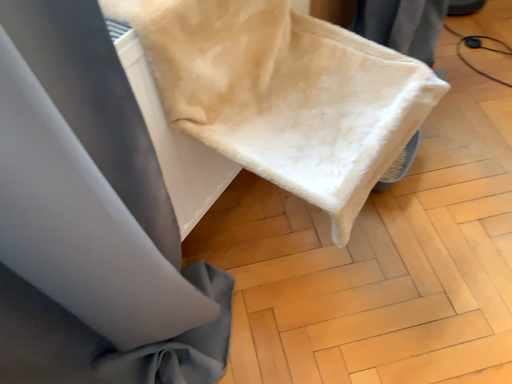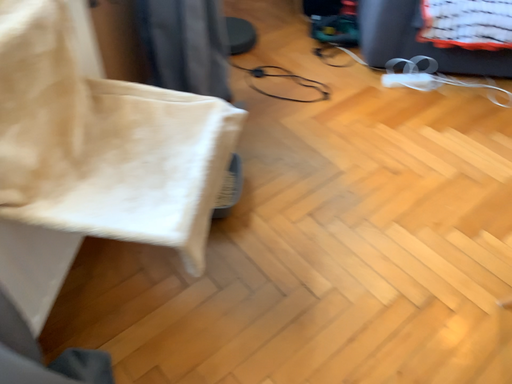
Question: How did the camera likely rotate when shooting the video?

Choices:
 (A) rotated right
 (B) rotated left

Answer: (A)